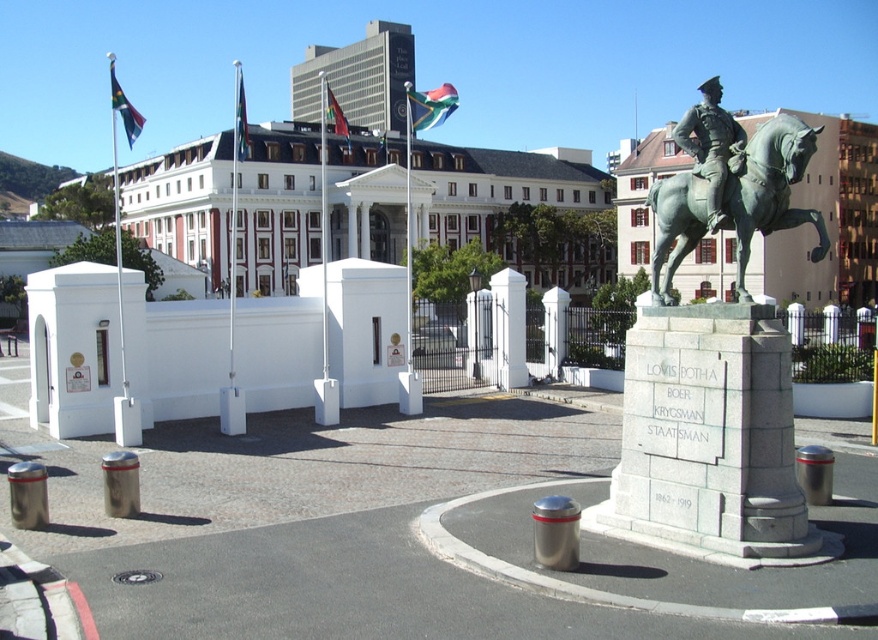
You are an event planner setting up a ceremony at this historical site. You need to determine which flag, the polyester flag at upper center or the matte black flag at upper left, should be placed in a more prominent position based on their height. Which flag should be placed higher?

The matte black flag at upper left should be placed higher because the polyester flag at upper center is not as tall as the matte black flag at upper left.

You are standing in front of the statue of Louis Botha and want to take a photo. You notice two points marked on the ground at coordinates point (704, 144) and point (240, 150). Which point is closer to you?

Point (704, 144) is closer to the viewer than point (240, 150).